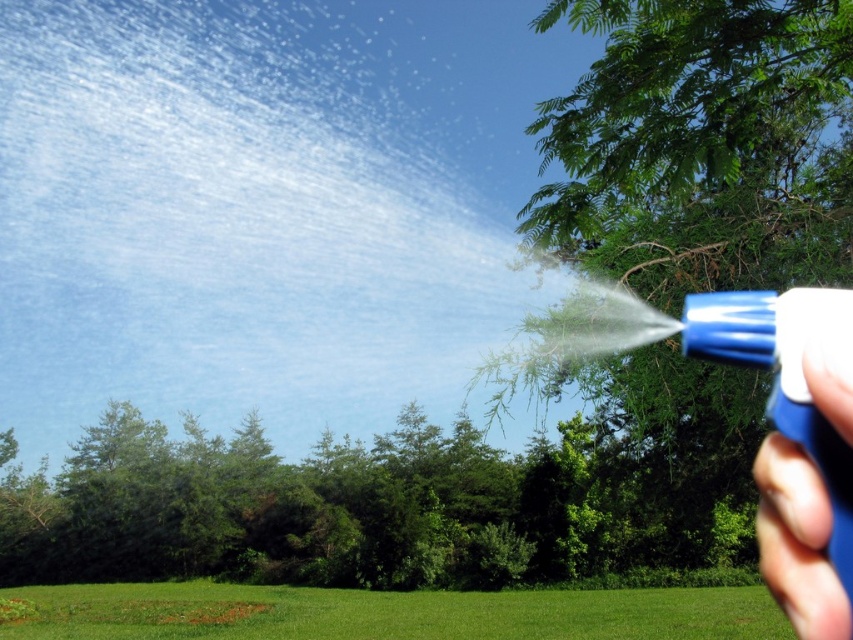
Question: Which object appears farthest from the camera in this image?

Choices:
 (A) blue plastic spray nozzle at lower right
 (B) green leafy tree at upper right

Answer: (B)

Question: Which point is closer to the camera?

Choices:
 (A) blue plastic spray nozzle at lower right
 (B) green leafy tree at upper right

Answer: (A)

Question: Which object appears closest to the camera in this image?

Choices:
 (A) blue plastic spray nozzle at lower right
 (B) green leafy tree at upper right

Answer: (A)

Question: Is green leafy tree at upper right wider than blue plastic spray nozzle at lower right?

Choices:
 (A) yes
 (B) no

Answer: (A)

Question: Does green leafy tree at upper right have a smaller size compared to blue plastic spray nozzle at lower right?

Choices:
 (A) yes
 (B) no

Answer: (B)

Question: Is green leafy tree at upper right below blue plastic spray nozzle at lower right?

Choices:
 (A) yes
 (B) no

Answer: (A)